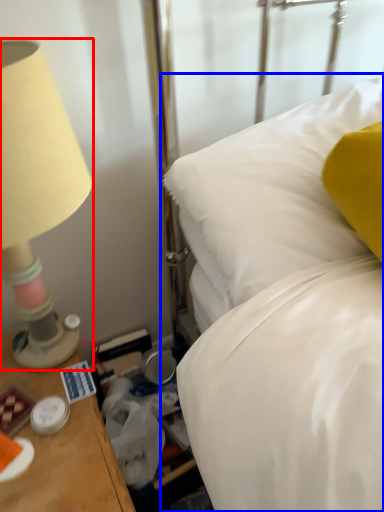
Question: Which object appears closest to the camera in this image, lamp (highlighted by a red box) or bed (highlighted by a blue box)?

Choices:
 (A) lamp
 (B) bed

Answer: (A)